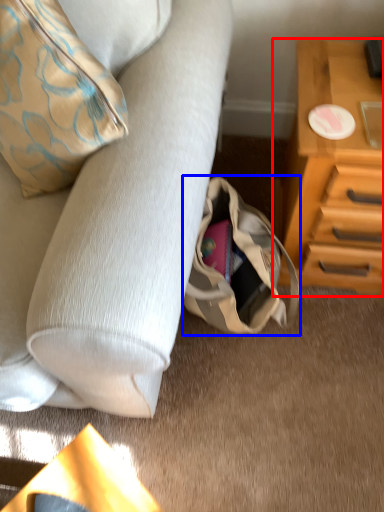
Question: Which object is further to the camera taking this photo, chest of drawers (highlighted by a red box) or handbag (highlighted by a blue box)?

Choices:
 (A) chest of drawers
 (B) handbag

Answer: (B)